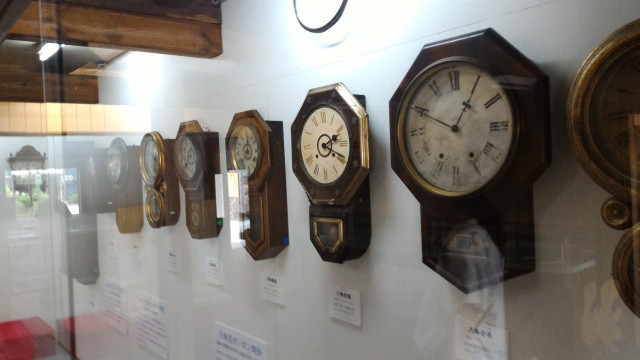
You are a GUI agent. You are given a task and a screenshot of the screen. Output one action in this format:
    pyautogui.click(x=<x>, y=<y>)
    Task: Click on the wall clock
    
    Given the screenshot: What is the action you would take?
    pyautogui.click(x=249, y=148), pyautogui.click(x=338, y=140), pyautogui.click(x=460, y=129), pyautogui.click(x=605, y=131), pyautogui.click(x=192, y=163), pyautogui.click(x=161, y=163), pyautogui.click(x=129, y=165), pyautogui.click(x=28, y=166), pyautogui.click(x=92, y=165)